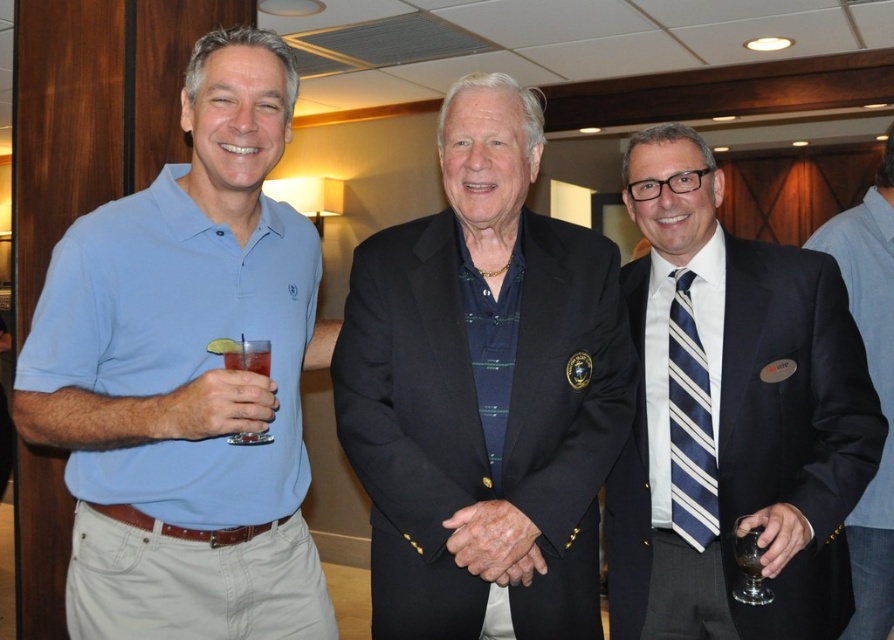
You are a server at the event and need to place a new drink order for the man in the black textured blazer at center. Where should you place the drink relative to the matte plastic cup at left?

The black textured blazer at center is taller than the matte plastic cup at left, so you should place the new drink next to the matte plastic cup at left since it is shorter and less likely to block the view of the blazer.

You are a photographer at the event and want to take a portrait of the matte blue polo shirt at left without the translucent glass at lower right appearing in the background. Is this possible based on their positions?

The matte blue polo shirt at left is located above the translucent glass at lower right, so if you position the camera to focus on the upper area where the shirt is, the glass would be below and out of frame, making it possible to avoid the glass in the background.